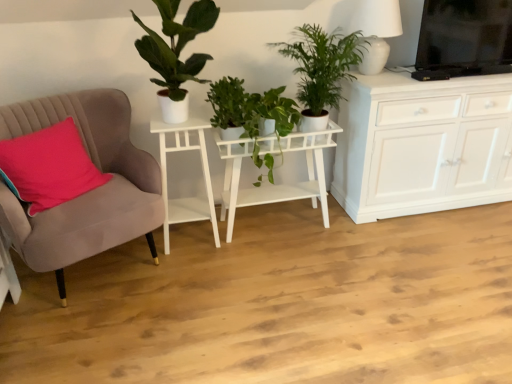
This screenshot has height=384, width=512. I want to click on free space to the left of white matte side table at left, which is counted as the 1th table, starting from the left, so click(135, 252).